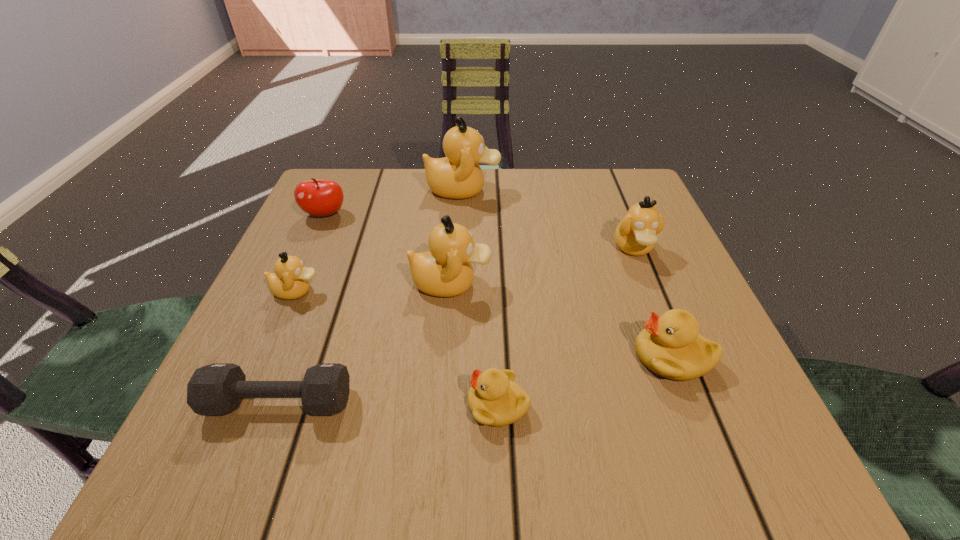
Identify the location of object that is the fourth closest to the second smallest tan duckling. Image resolution: width=960 pixels, height=540 pixels. (494, 399).

Locate an element on the screen. The image size is (960, 540). duckling that stands as the third closest to the apple is located at coordinates (445, 271).

Locate an element on the screen. The width and height of the screenshot is (960, 540). duckling that can be found as the fourth closest to the apple is located at coordinates (494, 399).

Identify which tan duckling is the nearest to the rightmost tan duckling. Please provide its 2D coordinates. Your answer should be formatted as a tuple, i.e. [(x, y)], where the tuple contains the x and y coordinates of a point satisfying the conditions above.

[(458, 175)]

Locate which tan duckling is the fourth closest to the shortest duckling. Please provide its 2D coordinates. Your answer should be formatted as a tuple, i.e. [(x, y)], where the tuple contains the x and y coordinates of a point satisfying the conditions above.

[(458, 175)]

Find the location of a particular element. blank area in the image that satisfies the following two spatial constraints: 1. on the face of the smallest tan duckling; 2. on the right side of the dumbbell is located at coordinates (249, 402).

Image resolution: width=960 pixels, height=540 pixels. Find the location of `vacant space that satisfies the following two spatial constraints: 1. on the face of the third biggest tan duckling; 2. on the front-facing side of the shortest duckling`. vacant space that satisfies the following two spatial constraints: 1. on the face of the third biggest tan duckling; 2. on the front-facing side of the shortest duckling is located at coordinates (697, 404).